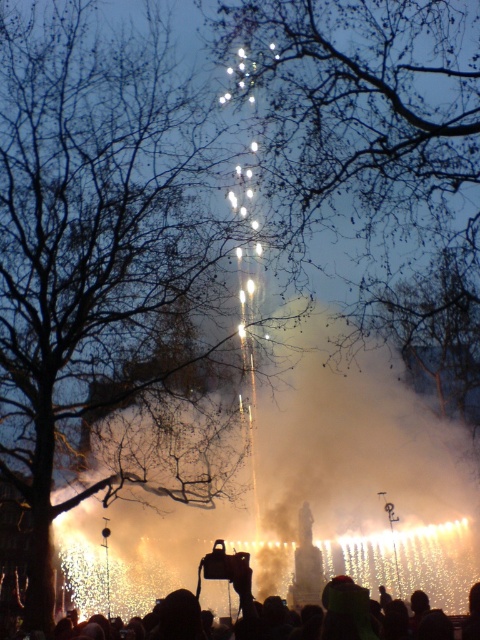
At what (x,y) coordinates should I click in order to perform the action: click on bare branches at center. Please return your answer as a coordinate pair (x, y). Looking at the image, I should click on (115, 273).

Between bare branches at center and silhouette crowd at lower center, which one is positioned lower?

silhouette crowd at lower center is lower down.

Find the location of a particular element. bare branches at center is located at coordinates [x=115, y=273].